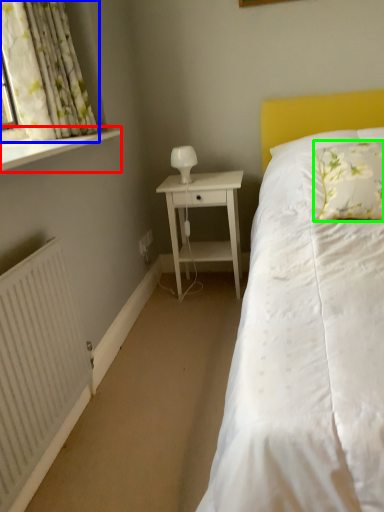
Question: Which object is the farthest from window sill (highlighted by a red box)? Choose among these: curtain (highlighted by a blue box) or pillow (highlighted by a green box).

Choices:
 (A) curtain
 (B) pillow

Answer: (B)